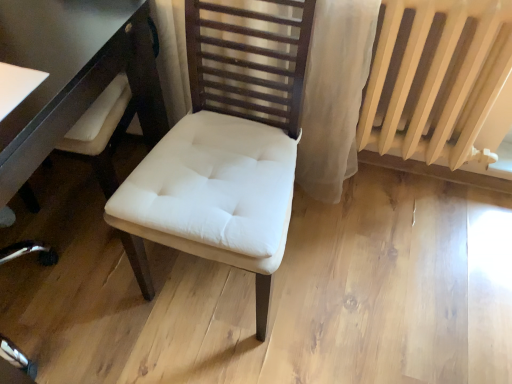
Where is `vacant area that is in front of white fabric chair at center`? This screenshot has height=384, width=512. vacant area that is in front of white fabric chair at center is located at coordinates (228, 354).